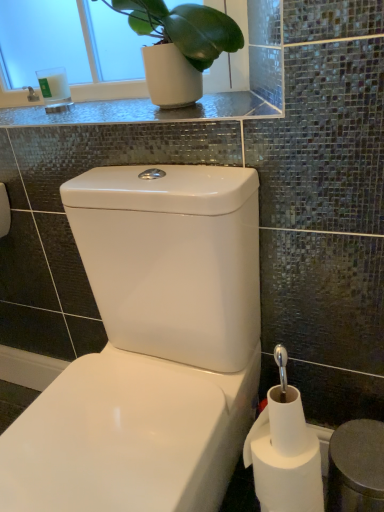
Question: From a real-world perspective, is shiny glass countertop at upper center physically located above or below green matte plant at upper left?

Choices:
 (A) below
 (B) above

Answer: (A)

Question: Looking at the image, does shiny glass countertop at upper center seem bigger or smaller compared to green matte plant at upper left?

Choices:
 (A) big
 (B) small

Answer: (B)

Question: Based on their relative distances, which object is farther from the white matte toilet paper at lower right?

Choices:
 (A) white glass candle at upper left
 (B) green matte plant at upper left
 (C) shiny glass countertop at upper center
 (D) white glossy toilet at center

Answer: (A)

Question: Which is farther from the green matte plant at upper left?

Choices:
 (A) white matte toilet paper at lower right
 (B) white glass candle at upper left
 (C) white glossy toilet at center
 (D) shiny glass countertop at upper center

Answer: (A)